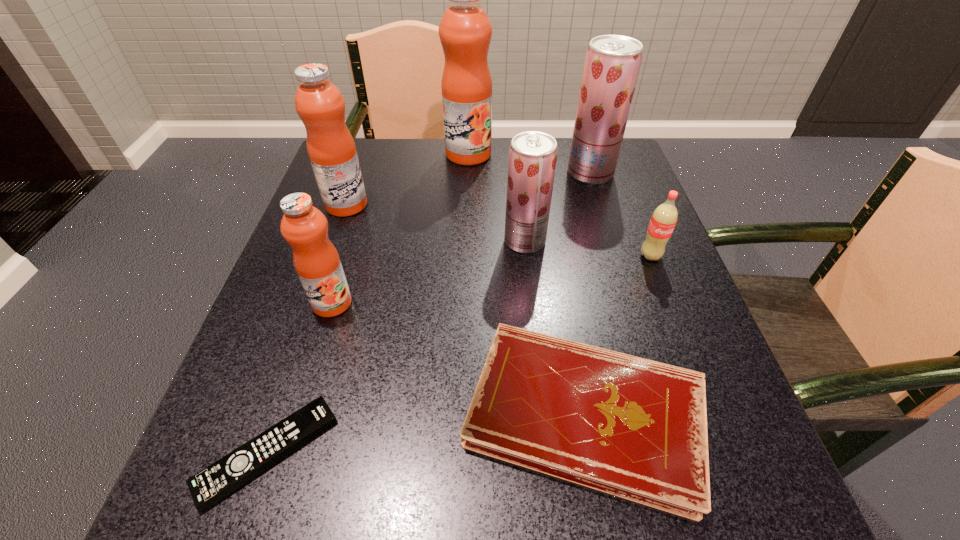
The height and width of the screenshot is (540, 960). Find the location of `object present at the near right corner`. object present at the near right corner is located at coordinates (634, 428).

In the image, there is a desktop. In order to click on vacant space at the far edge in this screenshot , I will do 495,159.

The width and height of the screenshot is (960, 540). I want to click on free space at the near edge, so click(x=524, y=535).

Where is `vacant space at the left edge`? Image resolution: width=960 pixels, height=540 pixels. vacant space at the left edge is located at coordinates (293, 461).

In order to click on free space at the right edge of the desktop in this screenshot , I will do `click(727, 447)`.

Where is `vacant space at the far left corner of the desktop`? The width and height of the screenshot is (960, 540). vacant space at the far left corner of the desktop is located at coordinates (359, 159).

The height and width of the screenshot is (540, 960). In the image, there is a desktop. In order to click on vacant region at the near left corner in this screenshot , I will do `click(186, 525)`.

Find the location of a particular element. This screenshot has width=960, height=540. unoccupied position between the second biggest orange fruit juice and the second fruit juice from right to left is located at coordinates (436, 223).

Where is `vacant area that lies between the fourth fruit juice from left to right and the tallest fruit juice`? This screenshot has width=960, height=540. vacant area that lies between the fourth fruit juice from left to right and the tallest fruit juice is located at coordinates (496, 198).

Where is `free point between the tallest fruit juice and the sixth farthest object`? This screenshot has height=540, width=960. free point between the tallest fruit juice and the sixth farthest object is located at coordinates (400, 228).